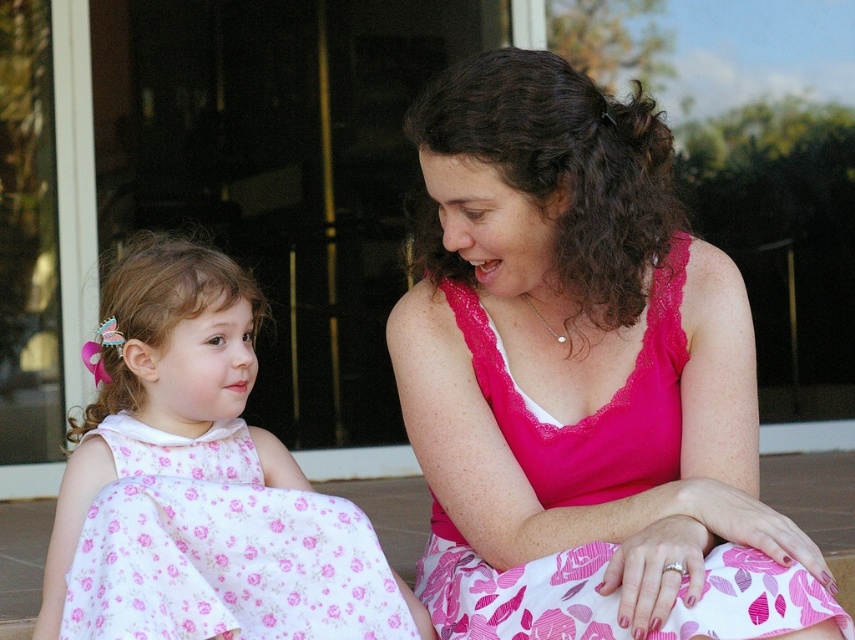
You are a photographer standing in front of the glass door with a dark interior. You want to take a photo of both the white floral dress at left and the pink floral fabric dress at center. Which dress will appear larger in the photo?

The white floral dress at left will appear larger in the photo because it is closer to the photographer than the pink floral fabric dress at center.

You are a photographer trying to capture a candid shot of the two girls in the scene. You want to ensure that both the white floral dress at left and the pink floral fabric dress at center are visible in the frame. Based on their positions, which dress should you focus on first to include both in the shot?

Since the white floral dress at left is to the left of the pink floral fabric dress at center, you should focus on the white floral dress at left first to ensure both are in the frame.